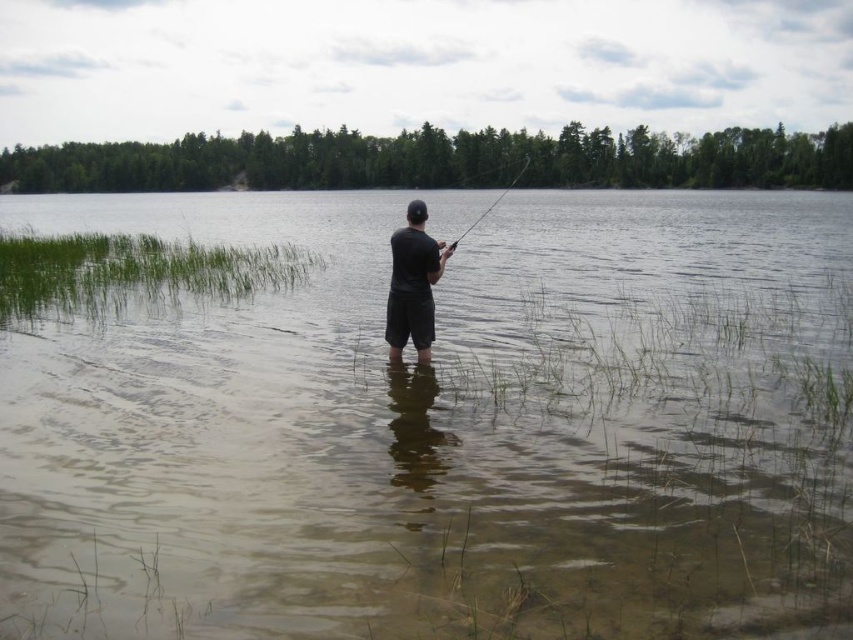
You are a photographer trying to capture the entire scene of the brown murky water at center and the black matte shorts at center in one shot. Given that your camera can only focus on objects within a 100cm width, will both objects fit in the frame?

The brown murky water at center is bigger than black matte shorts at center. Since the camera can focus on objects within a 100cm width, but the exact sizes aren

You are a lifeguard standing on the lakeside dock. You notice a person in black matte shorts at center and a smooth black rod at center. Can you safely reach the person with a 10 foot rescue pole if you are positioned at the dock?

The distance between the black matte shorts at center and smooth black rod at center is 8.48 feet. Since the rescue pole is 10 feet long, you can safely reach the person with the pole.

You are a photographer aiming to capture the smooth black rod at center and the brown murky water at center in your shot. Since you want the rod to be the main focus, should you position the camera to the left or right side of the rod to ensure it stands out against the water?

You should position the camera to the left side of the smooth black rod at center because the brown murky water at center is on its right side, so placing the camera to the left will place the rod in front of the water, making it the focal point.